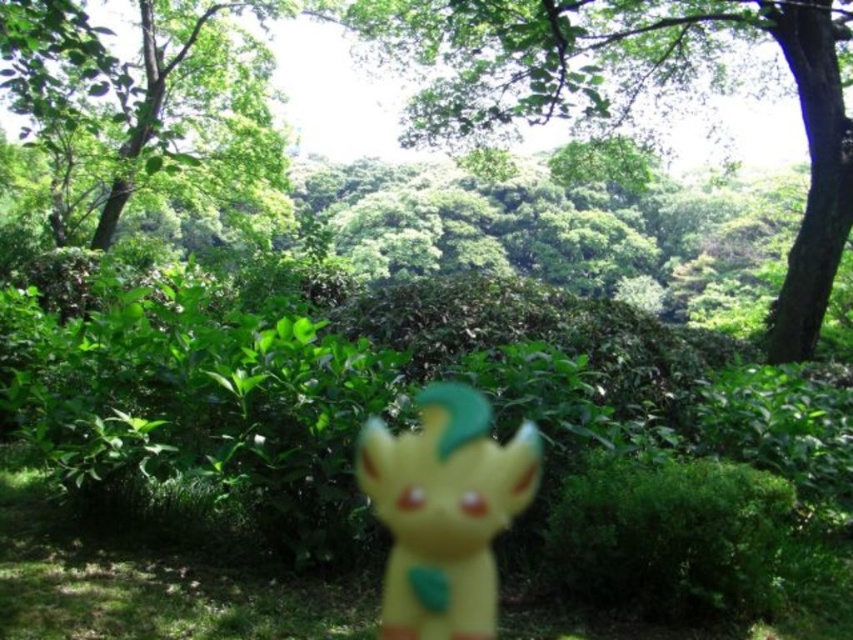
Question: Which of the following is the closest to the observer?

Choices:
 (A) click(132, 72)
 (B) click(596, 42)

Answer: (B)

Question: Does green leafy tree at upper center appear over green leafy tree at upper left?

Choices:
 (A) no
 (B) yes

Answer: (A)

Question: Does green leafy tree at upper left appear over yellow matte figurine at center?

Choices:
 (A) yes
 (B) no

Answer: (A)

Question: Observing the image, what is the correct spatial positioning of green leafy tree at upper center in reference to yellow matte grass at center?

Choices:
 (A) above
 (B) below

Answer: (A)

Question: Which point is closer to the camera?

Choices:
 (A) yellow matte grass at center
 (B) green leafy tree at upper center
 (C) yellow matte figurine at center
 (D) green leafy tree at upper left

Answer: (A)

Question: Which of the following is the farthest from the observer?

Choices:
 (A) (196, 573)
 (B) (260, 196)
 (C) (492, 522)
 (D) (601, 56)

Answer: (B)